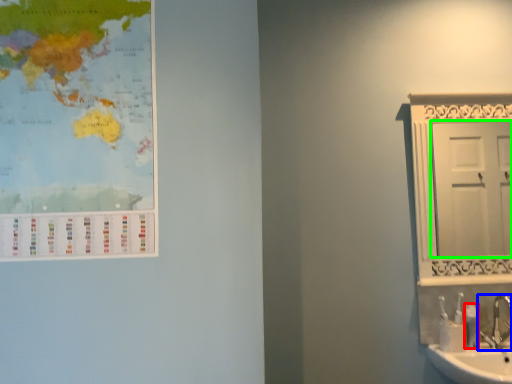
Question: Estimate the real-world distances between objects in this image. Which object is farther from toiletry (highlighted by a red box), tap (highlighted by a blue box) or door (highlighted by a green box)?

Choices:
 (A) tap
 (B) door

Answer: (B)